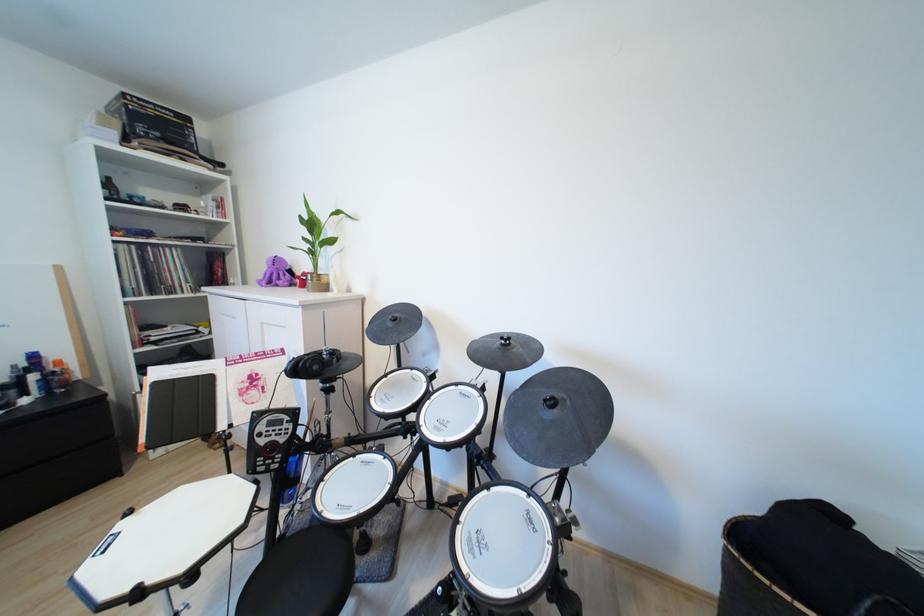
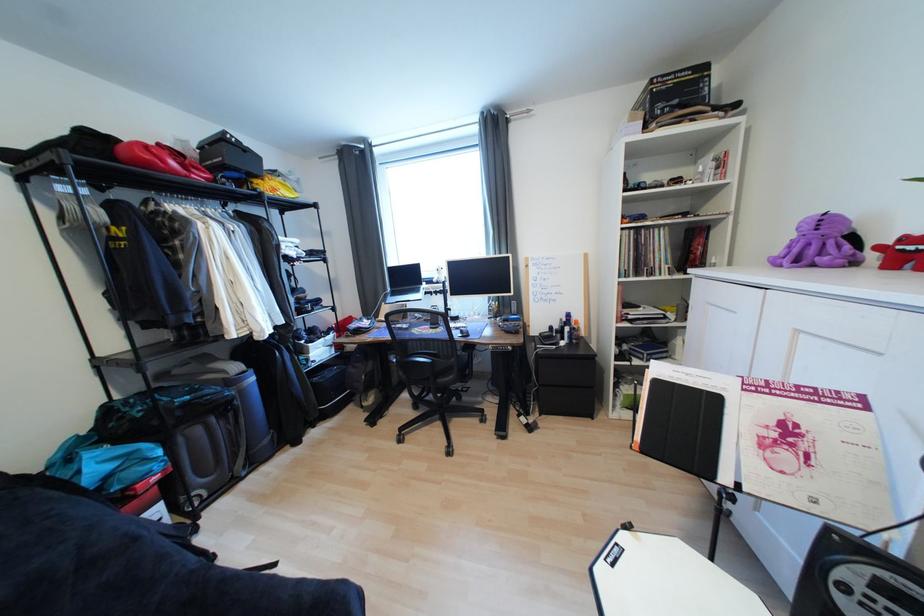
Question: The camera is either moving clockwise (left) or counter-clockwise (right) around the object. The first image is from the beginning of the video and the second image is from the end. Is the camera moving left or right when shooting the video?

Choices:
 (A) Left
 (B) Right

Answer: (B)